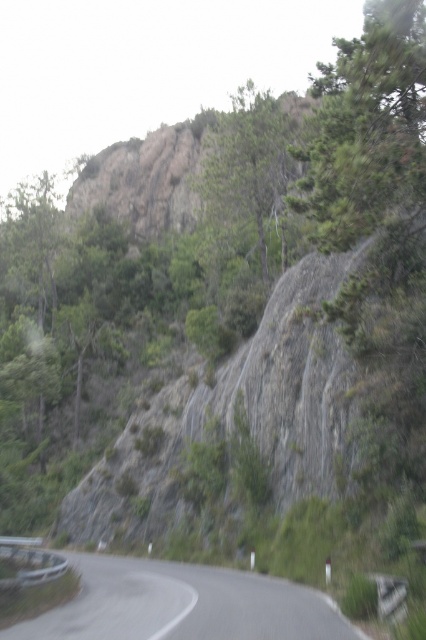
Question: Is green textured tree at upper right below green leafy tree at upper center?

Choices:
 (A) no
 (B) yes

Answer: (B)

Question: Is green textured tree at upper right closer to the viewer compared to gray asphalt road at lower center?

Choices:
 (A) yes
 (B) no

Answer: (B)

Question: Is green textured tree at upper right to the left of gray asphalt road at lower center from the viewer's perspective?

Choices:
 (A) yes
 (B) no

Answer: (B)

Question: Considering the real-world distances, which object is farthest from the gray asphalt road at lower center?

Choices:
 (A) green leafy tree at upper center
 (B) green textured tree at upper right

Answer: (A)

Question: Among these objects, which one is farthest from the camera?

Choices:
 (A) green leafy tree at upper center
 (B) gray asphalt road at lower center
 (C) green textured tree at upper right

Answer: (A)

Question: Which is farther from the gray asphalt road at lower center?

Choices:
 (A) green leafy tree at upper center
 (B) green textured tree at upper right

Answer: (A)